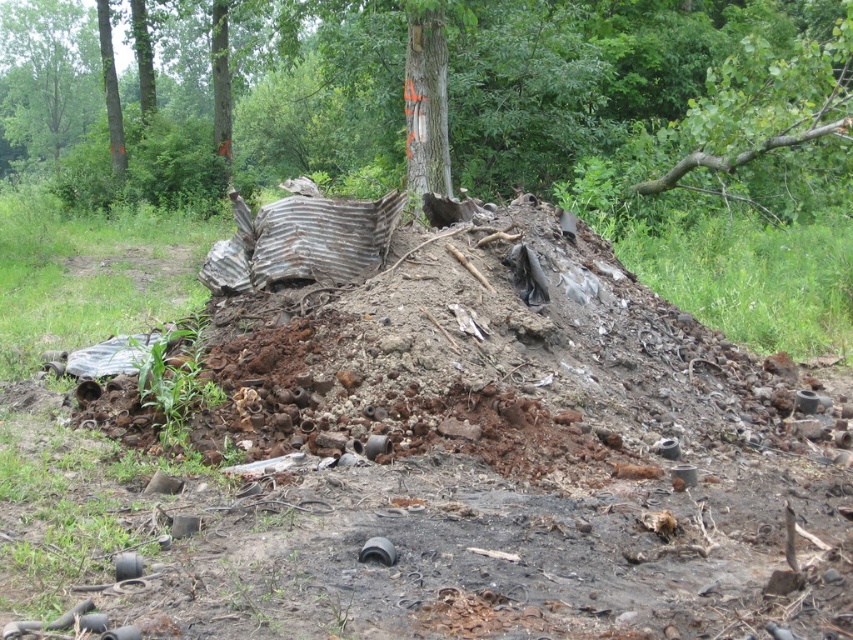
Does smooth bark tree at center have a greater height compared to smooth brown tree trunk at center?

Indeed, smooth bark tree at center has a greater height compared to smooth brown tree trunk at center.

Locate an element on the screen. Image resolution: width=853 pixels, height=640 pixels. smooth bark tree at center is located at coordinates (448, 99).